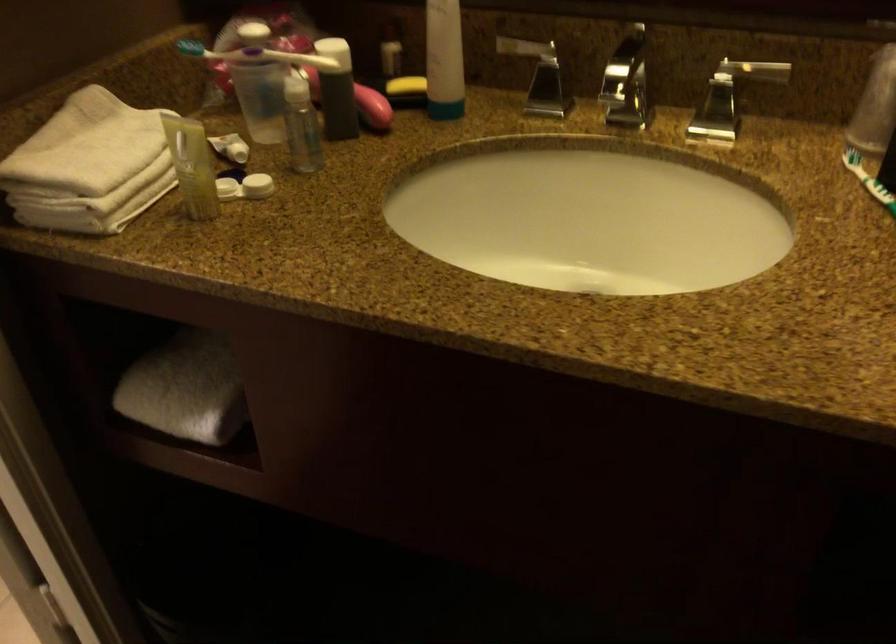
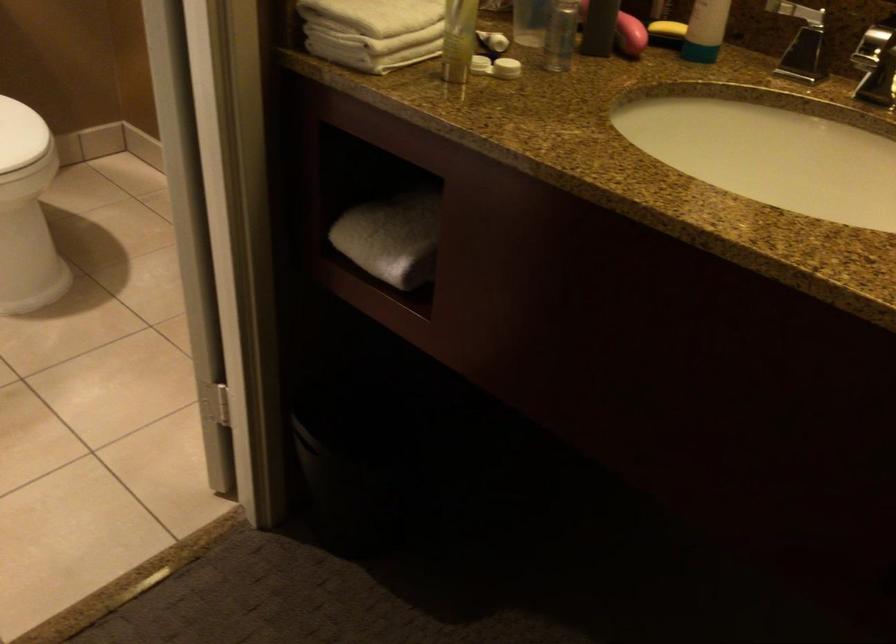
Locate, in the second image, the point that corresponds to [405,87] in the first image.

(667, 29)